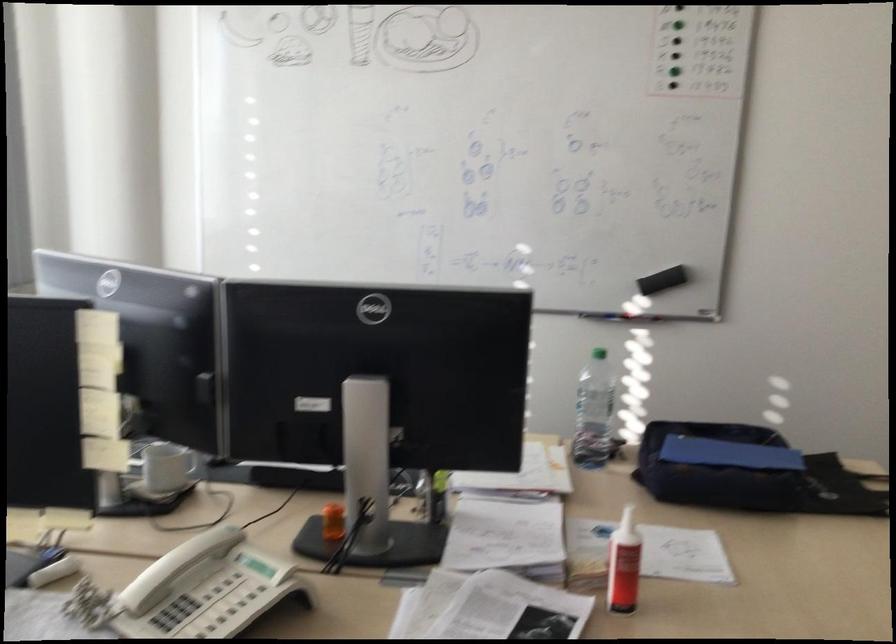
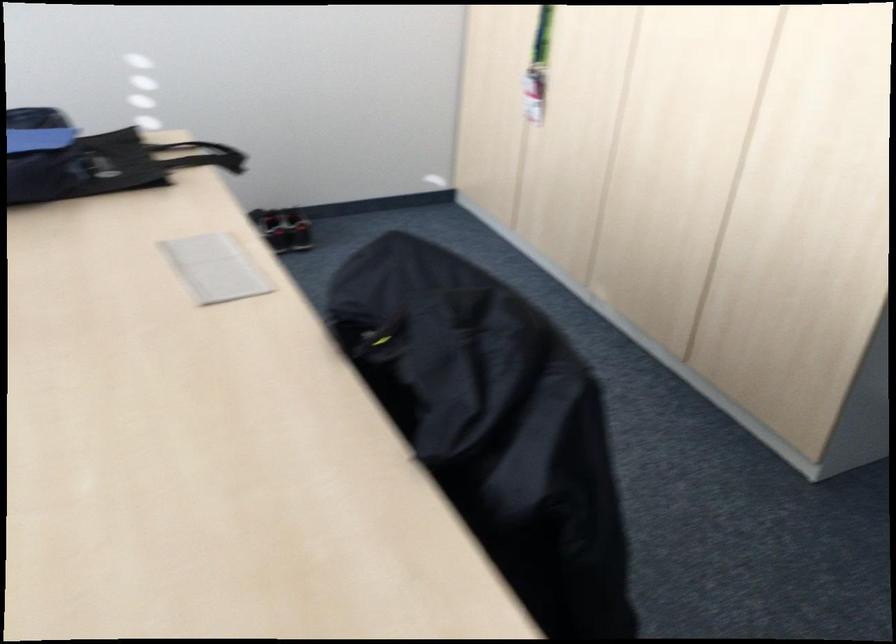
Based on the continuous images, in which direction is the camera rotating?

The rotation direction of the camera is right-down.